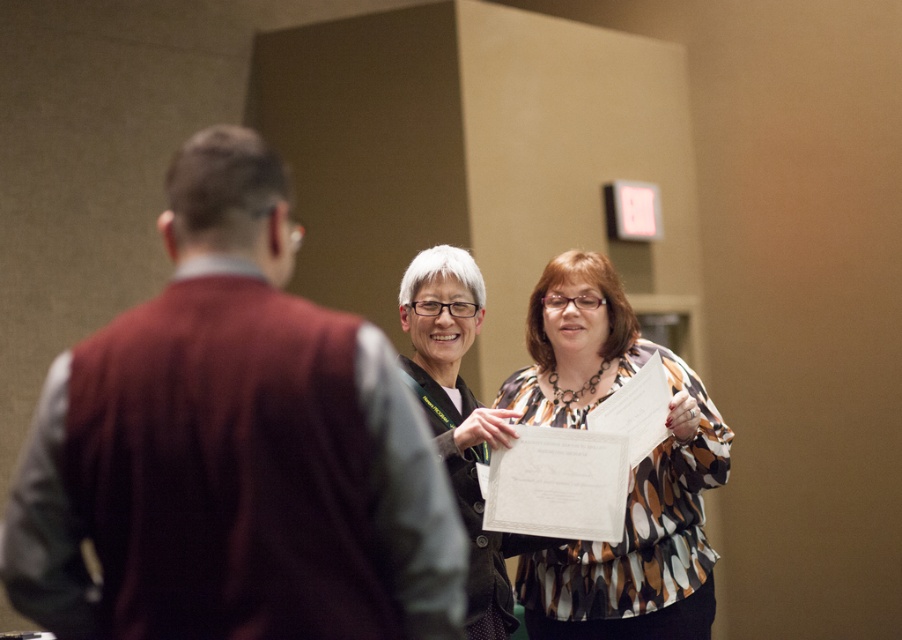
You are organizing a clothing donation drive and need to categorize items by size. You have a maroon sweater at left and a matte black jacket at center. Which item should you place in the large size bin?

The maroon sweater at left should be placed in the large size bin because it has a larger size compared to the matte black jacket at center.

You are organizing a photo shoot and need to arrange the maroon sweater at left and the multicolored printed blouse at center based on their heights. Which should you place in a position requiring a taller model?

The multicolored printed blouse at center should be placed in the position requiring a taller model because it is taller than the maroon sweater at left.